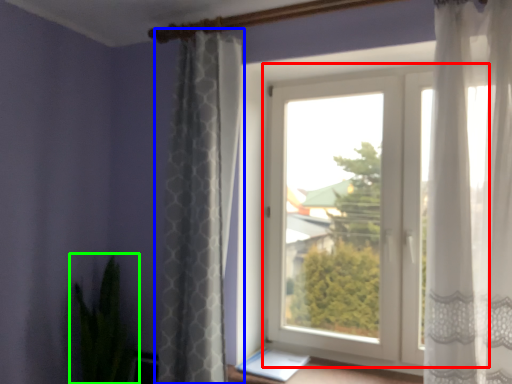
Question: Which is nearer to the window (highlighted by a red box)? curtain (highlighted by a blue box) or houseplant (highlighted by a green box).

Choices:
 (A) curtain
 (B) houseplant

Answer: (A)